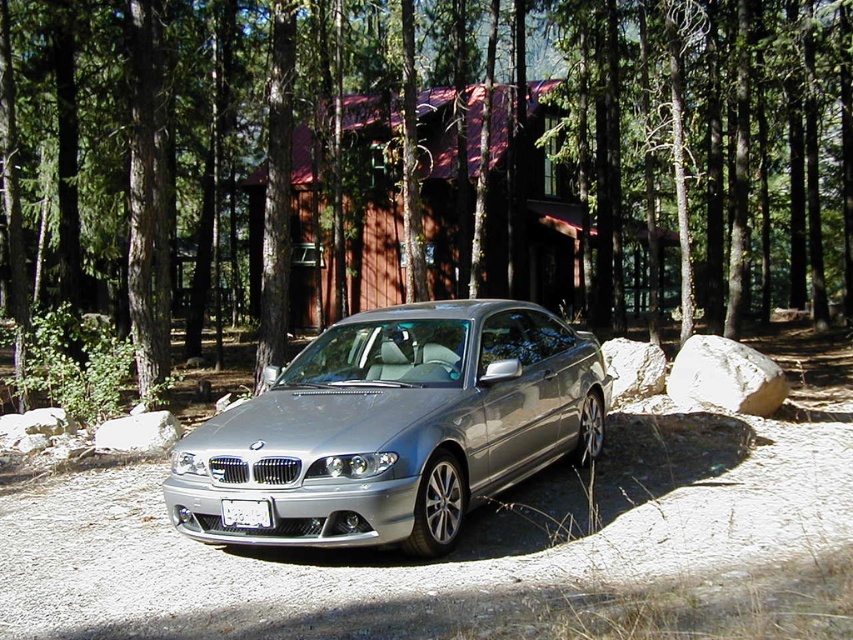
Question: Does brown wooden cabin at center have a lesser width compared to white smooth rock at right?

Choices:
 (A) no
 (B) yes

Answer: (A)

Question: Does satin silver car at center appear under brown wooden cabin at center?

Choices:
 (A) yes
 (B) no

Answer: (A)

Question: Is satin silver car at center positioned before brown wooden cabin at center?

Choices:
 (A) yes
 (B) no

Answer: (A)

Question: Which is farther from the green matte tree at center?

Choices:
 (A) brown wooden cabin at center
 (B) white smooth rock at right
 (C) white plastic license plate at center

Answer: (C)

Question: Which point is farther from the camera taking this photo?

Choices:
 (A) (764, 355)
 (B) (358, 435)
 (C) (560, 81)

Answer: (C)

Question: Estimate the real-world distances between objects in this image. Which object is closer to the brown wooden cabin at center?

Choices:
 (A) white smooth rock at right
 (B) green matte tree at center

Answer: (B)